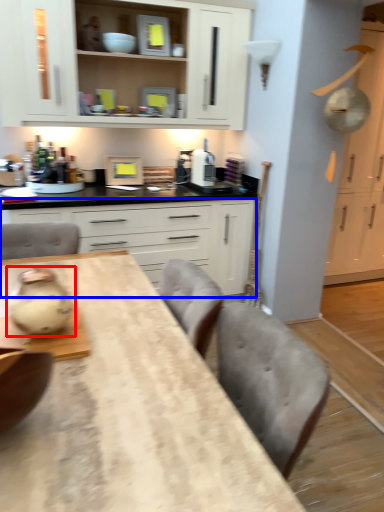
Question: Which object is closer to the camera taking this photo, tea pot (highlighted by a red box) or cabinetry (highlighted by a blue box)?

Choices:
 (A) tea pot
 (B) cabinetry

Answer: (A)